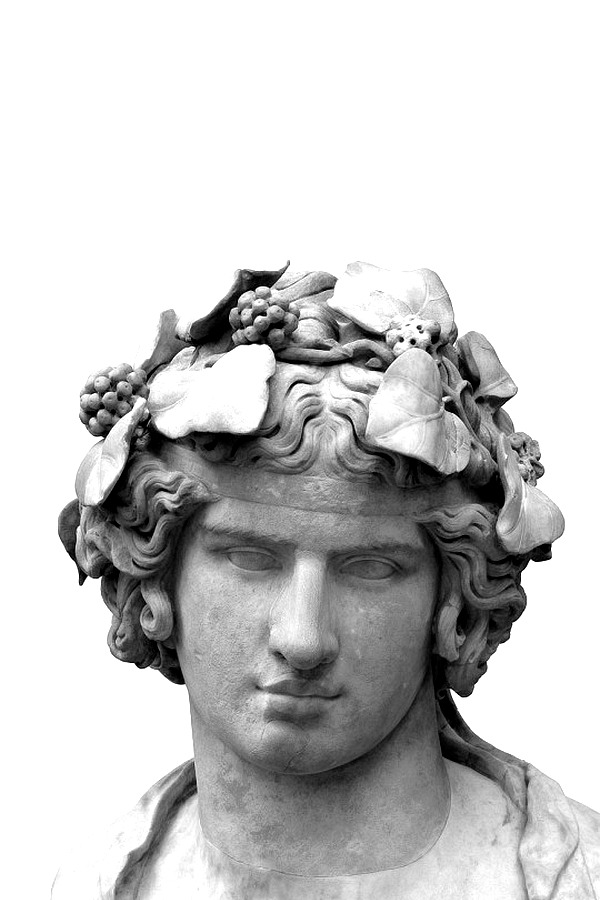
Where is `robe`? robe is located at coordinates (542, 844).